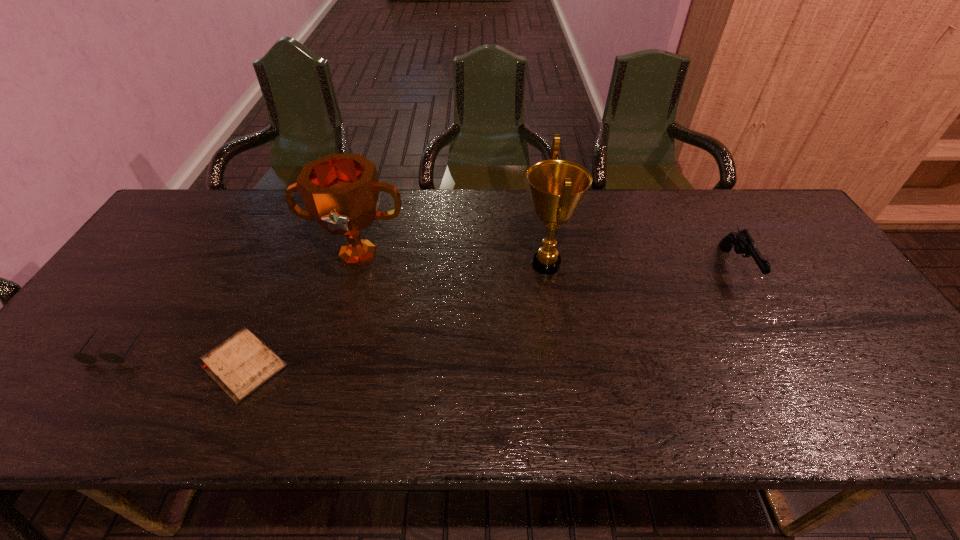
The image size is (960, 540). I want to click on free space between the tallest object and the shorter award, so click(x=452, y=259).

Where is `empty space that is in between the fourth object from left to right and the rightmost object`? Image resolution: width=960 pixels, height=540 pixels. empty space that is in between the fourth object from left to right and the rightmost object is located at coordinates click(x=641, y=266).

Where is `free space between the second tallest object and the shortest object`? free space between the second tallest object and the shortest object is located at coordinates (300, 310).

I want to click on free space between the diary and the second tallest object, so click(x=300, y=310).

What are the coordinates of `the closest object to the second tallest object` in the screenshot? It's located at click(x=240, y=365).

In order to click on the second closest object to the third tallest object in this screenshot , I will do `click(341, 192)`.

Where is `vacant region that satisfies the following two spatial constraints: 1. on the front view with handles of the right award; 2. on the front-facing side of the leftmost object`? The image size is (960, 540). vacant region that satisfies the following two spatial constraints: 1. on the front view with handles of the right award; 2. on the front-facing side of the leftmost object is located at coordinates (559, 349).

Identify the location of free space that satisfies the following two spatial constraints: 1. on the front-facing side of the leftmost object; 2. on the right side of the diary. This screenshot has width=960, height=540. (104, 366).

You are a GUI agent. You are given a task and a screenshot of the screen. Output one action in this format:
    pyautogui.click(x=<x>, y=<y>)
    Task: Click on the free space in the image that satisfies the following two spatial constraints: 1. on the front-facing side of the sunglasses; 2. on the left side of the shortest object
    
    Given the screenshot: What is the action you would take?
    pyautogui.click(x=104, y=366)